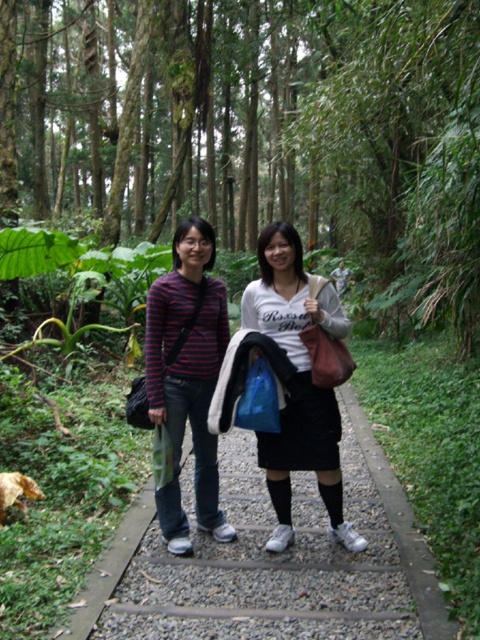
You are planning to walk along the gravel path at center in the forest. Considering the green leafy tree at center, which is wider than the path, will you be able to walk through the path without touching the tree?

The green leafy tree at center is wider than the gravel path at center, so walking through the path may require careful navigation to avoid touching the tree.

You are a photographer trying to capture both the striped cotton shirt at center and the white matte skirt at center in a single frame. Since the camera can only focus on one subject at a time, which object should you focus on first to ensure the taller one is in focus?

The striped cotton shirt at center is taller than the white matte skirt at center, so you should focus on the striped cotton shirt at center first to ensure it is in focus.